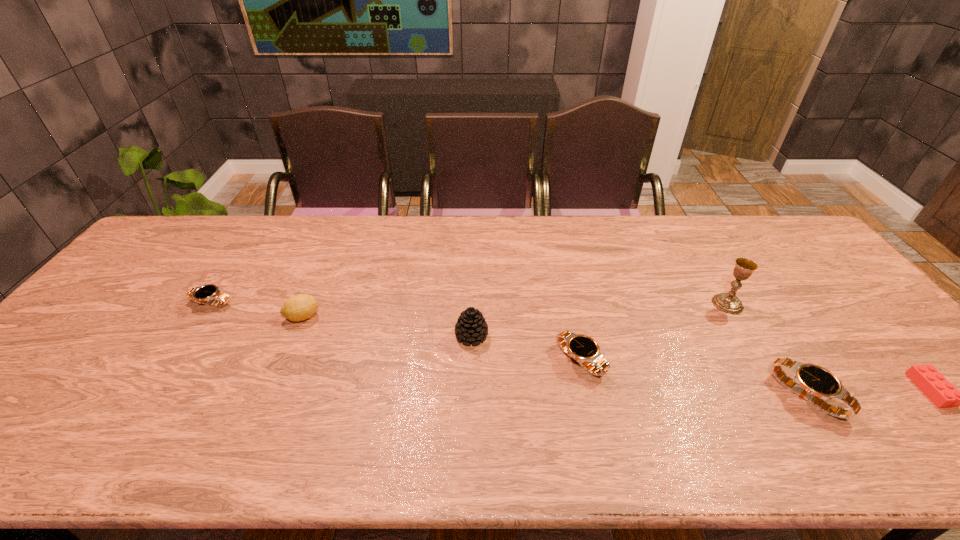
Find the location of a particular element. This screenshot has height=540, width=960. object that is positioned at the right edge is located at coordinates (930, 381).

Locate an element on the screen. The image size is (960, 540). object that is positioned at the near right corner is located at coordinates (930, 381).

I want to click on free location at the far edge, so click(245, 237).

In order to click on vacant area at the near edge of the desktop in this screenshot , I will do `click(688, 413)`.

This screenshot has height=540, width=960. In the image, there is a desktop. In order to click on vacant space at the right edge in this screenshot , I will do `click(825, 320)`.

The height and width of the screenshot is (540, 960). I want to click on vacant space at the far right corner of the desktop, so click(x=790, y=255).

The height and width of the screenshot is (540, 960). I want to click on unoccupied area between the chalice and the Lego, so click(x=829, y=347).

Image resolution: width=960 pixels, height=540 pixels. Identify the location of vacant region between the lemon and the rightmost watch. (555, 356).

This screenshot has width=960, height=540. Identify the location of unoccupied area between the lemon and the chalice. (515, 310).

Where is `vacant space in between the pinecone and the rightmost watch`? The width and height of the screenshot is (960, 540). vacant space in between the pinecone and the rightmost watch is located at coordinates (639, 366).